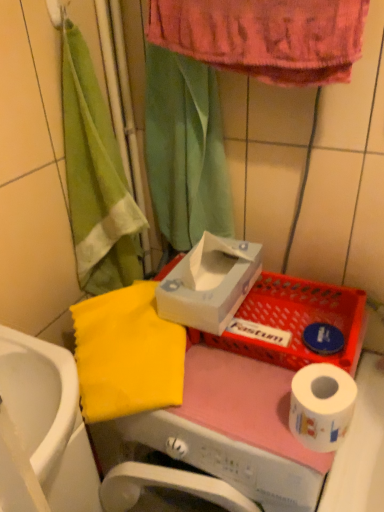
This screenshot has height=512, width=384. I want to click on white cardboard tissue box at center, so click(209, 283).

The image size is (384, 512). Find the location of `white glossy sink at lower left`. white glossy sink at lower left is located at coordinates (49, 419).

Where is `yellow fabric at left`? Image resolution: width=384 pixels, height=512 pixels. yellow fabric at left is located at coordinates (127, 354).

Can you confirm if green fabric shower curtain at upper center is taller than white paper at lower right?

Yes.

Is point (215, 110) positioned before point (303, 395)?

No, (215, 110) is further to viewer.

How many degrees apart are the facing directions of green fabric shower curtain at upper center and white paper at lower right?

The facing directions of green fabric shower curtain at upper center and white paper at lower right are 0.00942 degrees apart.

Consider the image. From the image's perspective, is white glossy sink at lower left below green fabric shower curtain at upper center?

Yes.

Locate an element on the screen. shower curtain located behind the white glossy sink at lower left is located at coordinates (185, 149).

Is white glossy sink at lower left positioned far away from green fabric shower curtain at upper center?

No, there isn't a large distance between white glossy sink at lower left and green fabric shower curtain at upper center.

Who is taller, white glossy sink at lower left or green fabric shower curtain at upper center?

white glossy sink at lower left.

How different are the orientations of yellow fabric at left and white paper at lower right in degrees?

The angle between the facing direction of yellow fabric at left and the facing direction of white paper at lower right is 25.3 degrees.

Considering the relative sizes of yellow fabric at left and white paper at lower right in the image provided, is yellow fabric at left shorter than white paper at lower right?

No, yellow fabric at left is not shorter than white paper at lower right.

This screenshot has width=384, height=512. In order to click on toilet paper below the yellow fabric at left (from the image's perspective) in this screenshot , I will do point(321,406).

Consider the image. From the image's perspective, would you say white paper at lower right is shown under yellow fabric at left?

Correct, white paper at lower right appears lower than yellow fabric at left in the image.

Image resolution: width=384 pixels, height=512 pixels. I want to click on beach towel beneath the white paper at lower right (from a real-world perspective), so click(x=127, y=354).

Is white paper at lower right far from yellow fabric at left?

white paper at lower right is actually quite close to yellow fabric at left.

From a real-world perspective, who is located lower, white cardboard tissue box at center or white glossy sink at lower left?

white glossy sink at lower left is physically lower.

Which point is more forward, [221,330] or [30,432]?

Positioned in front is point [30,432].

Is white cardboard tissue box at center facing towards white glossy sink at lower left?

No, white cardboard tissue box at center does not turn towards white glossy sink at lower left.

Considering the relative sizes of white cardboard tissue box at center and white glossy sink at lower left in the image provided, is white cardboard tissue box at center bigger than white glossy sink at lower left?

Actually, white cardboard tissue box at center might be smaller than white glossy sink at lower left.

Is green fabric shower curtain at upper center beside white cardboard tissue box at center?

→ No, green fabric shower curtain at upper center is not in contact with white cardboard tissue box at center.

Which object is wider, green fabric shower curtain at upper center or white cardboard tissue box at center?

white cardboard tissue box at center is wider.

Which is behind, green fabric shower curtain at upper center or white cardboard tissue box at center?

green fabric shower curtain at upper center is further from the camera.

Can you confirm if white glossy sink at lower left is positioned to the left of white paper at lower right?

Indeed, white glossy sink at lower left is positioned on the left side of white paper at lower right.

Which is correct: white glossy sink at lower left is inside white paper at lower right, or outside of it?

white glossy sink at lower left is spatially situated outside white paper at lower right.

From the picture: Relative to white paper at lower right, is white glossy sink at lower left in front or behind?

Clearly, white glossy sink at lower left is behind white paper at lower right.

At what (x,y) coordinates should I click in order to perform the action: click on toilet paper below the green fabric shower curtain at upper center (from the image's perspective). Please return your answer as a coordinate pair (x, y). The height and width of the screenshot is (512, 384). Looking at the image, I should click on (321, 406).

Find the location of a particular element. This screenshot has width=384, height=512. shower curtain located above the white glossy sink at lower left (from the image's perspective) is located at coordinates (185, 149).

From the image, which object appears to be nearer to white paper at lower right, green fabric shower curtain at upper center or yellow fabric at left?

A: Based on the image, yellow fabric at left appears to be nearer to white paper at lower right.

When comparing their distances from yellow fabric at left, does white paper at lower right or white glossy sink at lower left seem further?

Based on the image, white paper at lower right appears to be further to yellow fabric at left.

Estimate the real-world distances between objects in this image. Which object is closer to green fabric shower curtain at upper center, white paper at lower right or white cardboard tissue box at center?

white cardboard tissue box at center lies closer to green fabric shower curtain at upper center than the other object.

From the image, which object appears to be farther from green fabric shower curtain at upper center, yellow fabric at left or white cardboard tissue box at center?

Among the two, yellow fabric at left is located further to green fabric shower curtain at upper center.

Which object lies nearer to the anchor point white glossy sink at lower left, green fabric shower curtain at upper center or white cardboard tissue box at center?

Among the two, white cardboard tissue box at center is located nearer to white glossy sink at lower left.

Looking at the image, which one is located closer to green fabric shower curtain at upper center, white cardboard tissue box at center or white paper at lower right?

white cardboard tissue box at center.

From the image, which object appears to be farther from white glossy sink at lower left, white paper at lower right or green fabric shower curtain at upper center?

green fabric shower curtain at upper center lies further to white glossy sink at lower left than the other object.

Looking at the image, which one is located closer to white cardboard tissue box at center, green fabric shower curtain at upper center or yellow fabric at left?

The object closer to white cardboard tissue box at center is yellow fabric at left.

The height and width of the screenshot is (512, 384). I want to click on carton between green fabric shower curtain at upper center and white glossy sink at lower left in the vertical direction, so click(x=209, y=283).

Identify the location of toilet paper between green fabric shower curtain at upper center and white glossy sink at lower left in the vertical direction. This screenshot has width=384, height=512. (321, 406).

Locate an element on the screen. The image size is (384, 512). carton that lies between green fabric shower curtain at upper center and white paper at lower right from top to bottom is located at coordinates (209, 283).

The image size is (384, 512). In order to click on beach towel between green fabric shower curtain at upper center and white glossy sink at lower left in the up-down direction in this screenshot , I will do `click(127, 354)`.